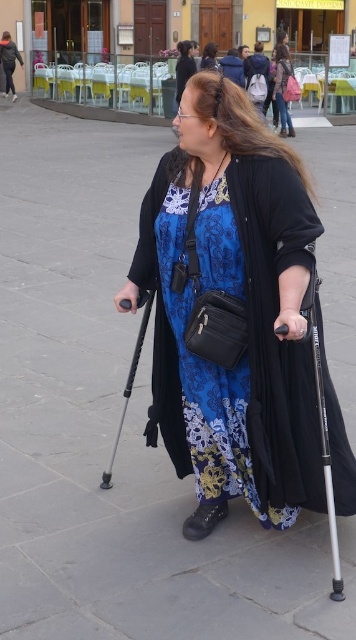
The woman is using two walking sticks and has a robe in the background. Which object is taller, the matte black crutches at center or the black matte robe at upper left?

The black matte robe at upper left is taller than the matte black crutches at center.

The woman is carrying two objects. Which one is bigger in size between the matte black crutches at center and the blue floral robe at center?

The matte black crutches at center has a larger size compared to the blue floral robe at center, so the matte black crutches at center is bigger.

You are a pedestrian standing at the origin point of the image coordinate system. You need to walk towards the metallic silver crutch at center. What are the coordinates you should head to?

The coordinates you should head to are 0.592 on the x axis and 0.365 on the y axis, which is the position of the metallic silver crutch at center.